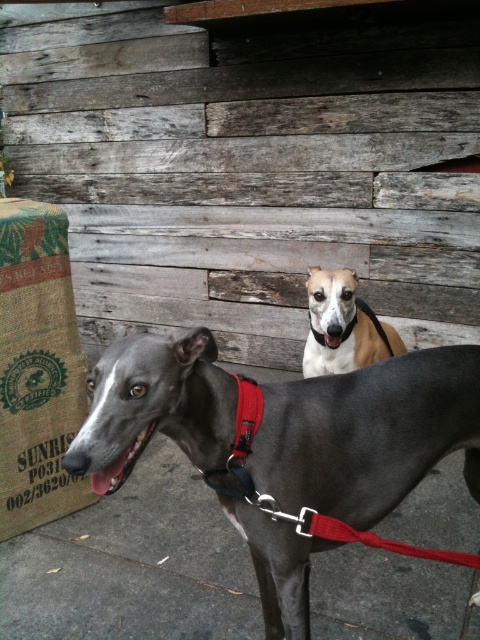
You are a photographer trying to capture both the burlap sack at left and the light brown fur at center in a single shot. Which object should you focus on first to ensure both are in focus?

You should focus on the burlap sack at left first because it is closer to you than the light brown fur at center, ensuring both will be in focus when focused on the closer object.

You are a photographer setting up a shoot in this scene. You want to position a reflector to bounce light onto the shiny black dog at center without it casting a shadow on the burlap sack at left. Where should you place the reflector relative to the dogs?

The shiny black dog at center is below the burlap sack at left. To avoid casting a shadow on the burlap sack, position the reflector above and to the side of the shiny black dog at center, ensuring light reflects downward onto it while keeping the shadow away from the burlap sack at left.